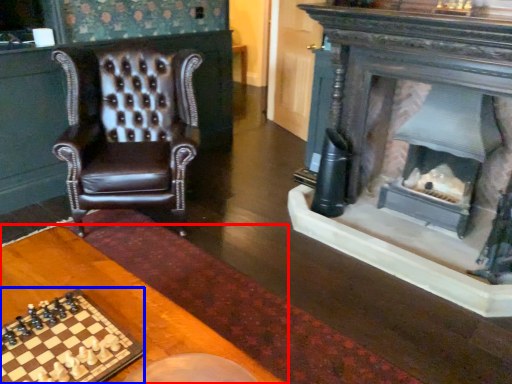
Question: Which object appears farthest to the camera in this image, table (highlighted by a red box) or board game (highlighted by a blue box)?

Choices:
 (A) table
 (B) board game

Answer: (B)